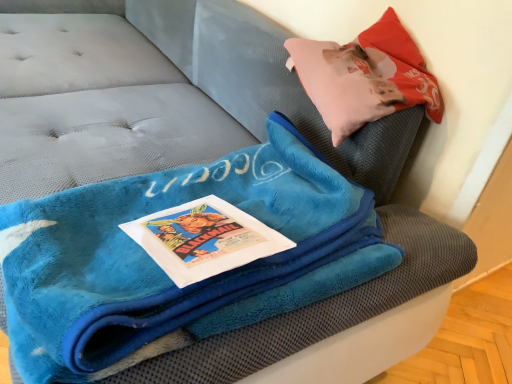
Question: Should I look upward or downward to see velvet pink pillow at upper right?

Choices:
 (A) down
 (B) up

Answer: (B)